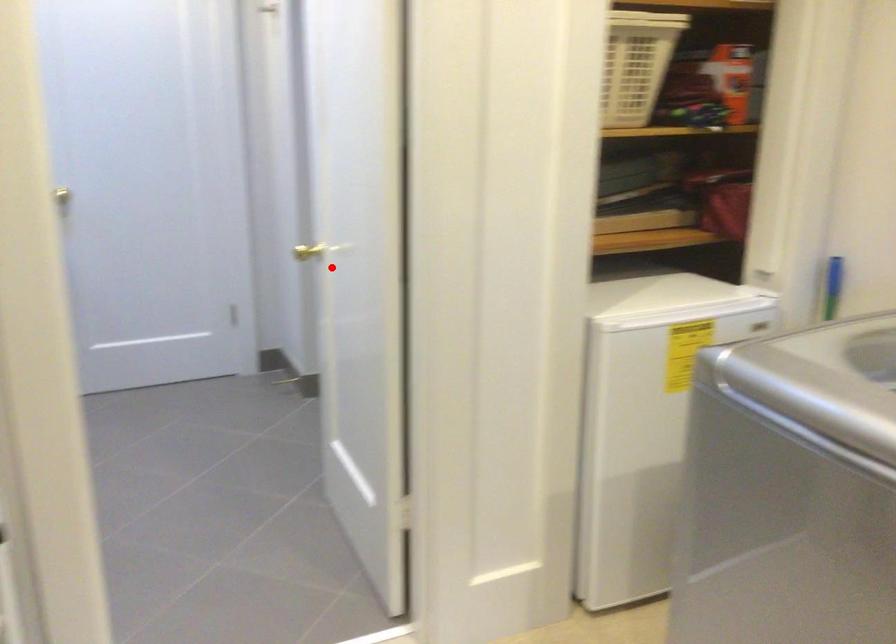
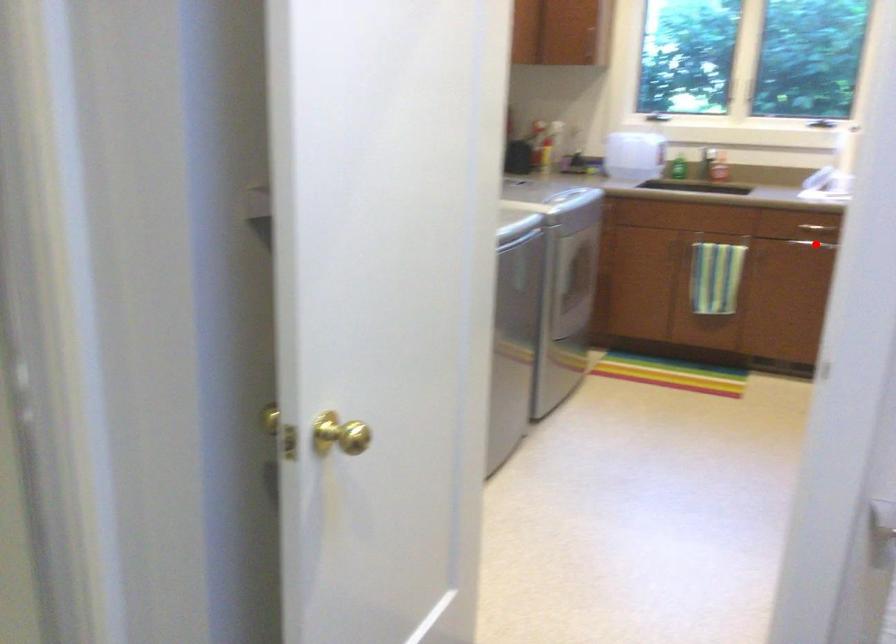
I am providing you with two images of the same scene from different viewpoints. A red point is marked on the first image and another point is marked on the second image. Does the point marked in image1 correspond to the same location as the one in image2?

No